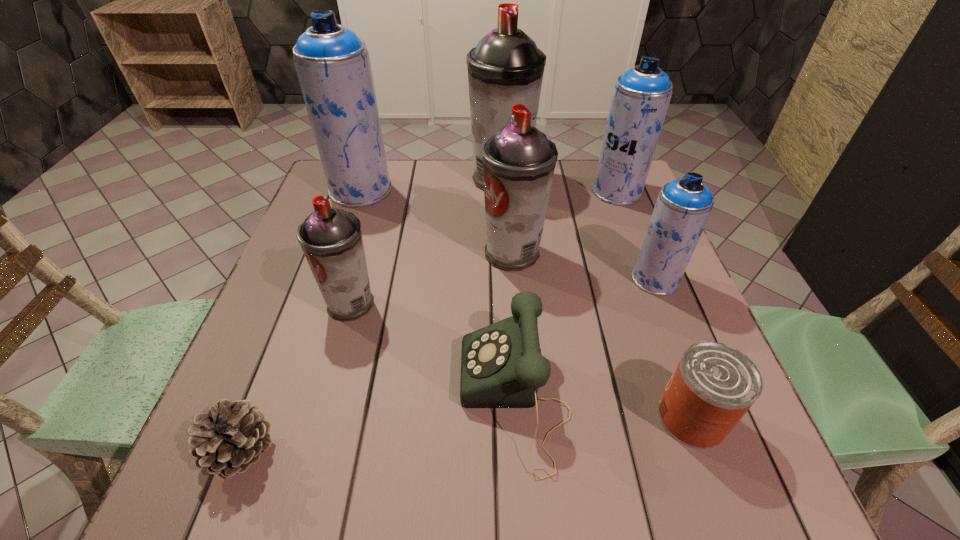
Locate an element on the screen. This screenshot has width=960, height=540. free point at the far edge is located at coordinates (408, 191).

Locate an element on the screen. free space at the near edge is located at coordinates (406, 490).

The image size is (960, 540). I want to click on vacant space at the left edge, so click(x=305, y=296).

Find the location of a particular element. vacant space at the right edge of the desktop is located at coordinates (608, 265).

I want to click on vacant area that lies between the second smallest gray aerosol can and the leftmost blue aerosol can, so click(437, 221).

Find the location of a particular element. free space between the smallest blue aerosol can and the farthest gray aerosol can is located at coordinates (579, 229).

This screenshot has height=540, width=960. In order to click on free space between the second biggest blue aerosol can and the shortest object in this screenshot , I will do `click(429, 321)`.

This screenshot has width=960, height=540. I want to click on free point between the telephone and the second smallest blue aerosol can, so (x=565, y=295).

At what (x,y) coordinates should I click in order to perform the action: click on unoccupied area between the second biggest blue aerosol can and the nearest blue aerosol can. Please return your answer as a coordinate pair (x, y). The width and height of the screenshot is (960, 540). Looking at the image, I should click on (636, 235).

What are the coordinates of `vacant area between the second biggest blue aerosol can and the can` in the screenshot? It's located at (655, 304).